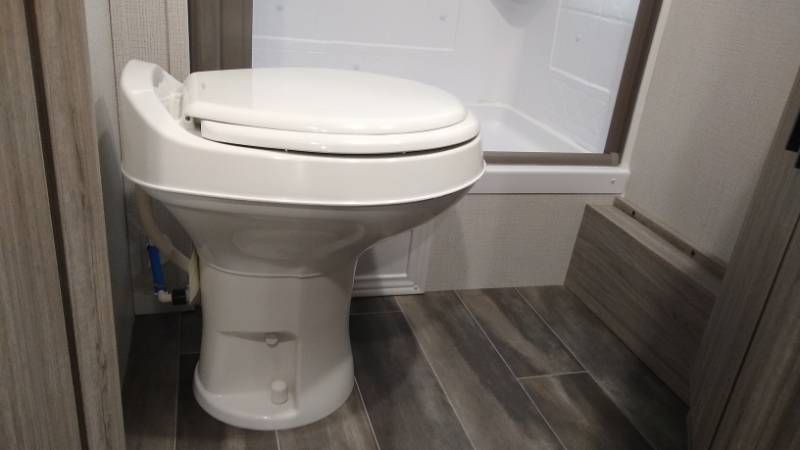
I want to click on commode, so click(x=169, y=150).